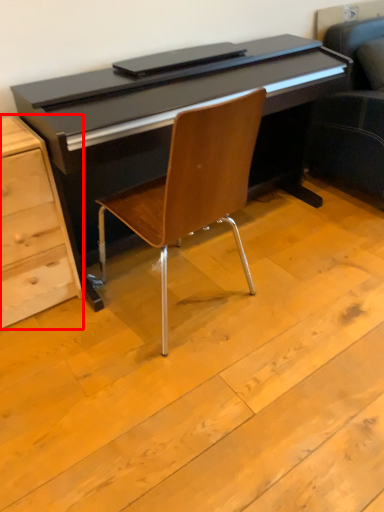
Question: Where is chest of drawers (annotated by the red box) located in relation to chair in the image?

Choices:
 (A) right
 (B) left

Answer: (B)